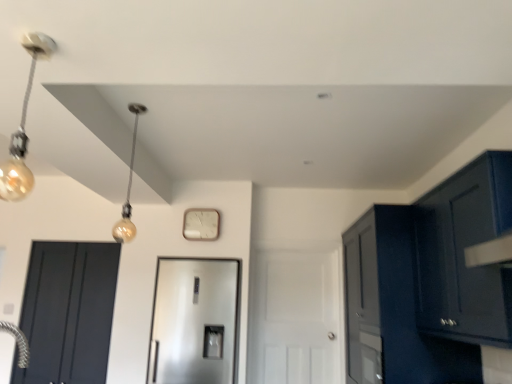
Question: Can you confirm if white matte clock at center is wider than glossy dark blue cabinet at upper right, which is the first cabinetry from front to back?

Choices:
 (A) yes
 (B) no

Answer: (B)

Question: Is white matte clock at center aimed at glossy dark blue cabinet at upper right, which is the first cabinetry from front to back?

Choices:
 (A) no
 (B) yes

Answer: (A)

Question: Is white matte clock at center positioned before glossy dark blue cabinet at upper right, which is the second cabinetry in back-to-front order?

Choices:
 (A) yes
 (B) no

Answer: (B)

Question: Is white matte clock at center surrounding glossy dark blue cabinet at upper right, which is the second cabinetry in back-to-front order?

Choices:
 (A) yes
 (B) no

Answer: (B)

Question: Can you confirm if white matte clock at center is positioned to the left of glossy dark blue cabinet at upper right, which is the first cabinetry from front to back?

Choices:
 (A) yes
 (B) no

Answer: (A)

Question: Is white matte clock at center beside glossy dark blue cabinet at upper right, which is the second cabinetry in back-to-front order?

Choices:
 (A) yes
 (B) no

Answer: (B)

Question: From a real-world perspective, does gold glass bulb at left sit lower than glossy dark blue cabinet at upper right, which is the second cabinetry in back-to-front order?

Choices:
 (A) no
 (B) yes

Answer: (A)

Question: Is gold glass bulb at left thinner than glossy dark blue cabinet at upper right, which is the second cabinetry in back-to-front order?

Choices:
 (A) no
 (B) yes

Answer: (B)

Question: Does gold glass bulb at left have a lesser height compared to glossy dark blue cabinet at upper right, which is the second cabinetry in back-to-front order?

Choices:
 (A) no
 (B) yes

Answer: (B)

Question: Can you confirm if gold glass bulb at left is taller than glossy dark blue cabinet at upper right, which is the first cabinetry from front to back?

Choices:
 (A) yes
 (B) no

Answer: (B)

Question: Is gold glass bulb at left smaller than glossy dark blue cabinet at upper right, which is the first cabinetry from front to back?

Choices:
 (A) yes
 (B) no

Answer: (A)

Question: Can you confirm if gold glass bulb at left is bigger than glossy dark blue cabinet at upper right, which is the second cabinetry in back-to-front order?

Choices:
 (A) yes
 (B) no

Answer: (B)

Question: Is matte black door at left, the 1th door positioned from the left, positioned with its back to satin silver refrigerator at center, placed as the second door when sorted from left to right?

Choices:
 (A) yes
 (B) no

Answer: (B)